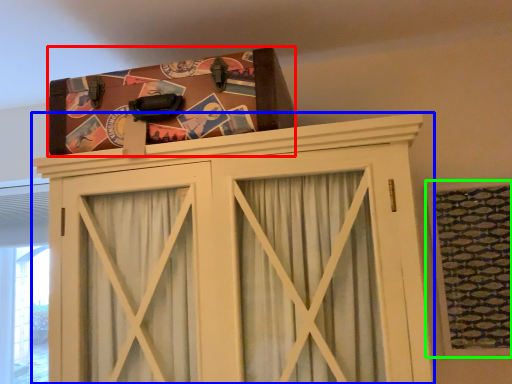
Question: Based on their relative distances, which object is nearer to package (highlighted by a red box)? Choose from cupboard (highlighted by a blue box) and window (highlighted by a green box).

Choices:
 (A) cupboard
 (B) window

Answer: (A)